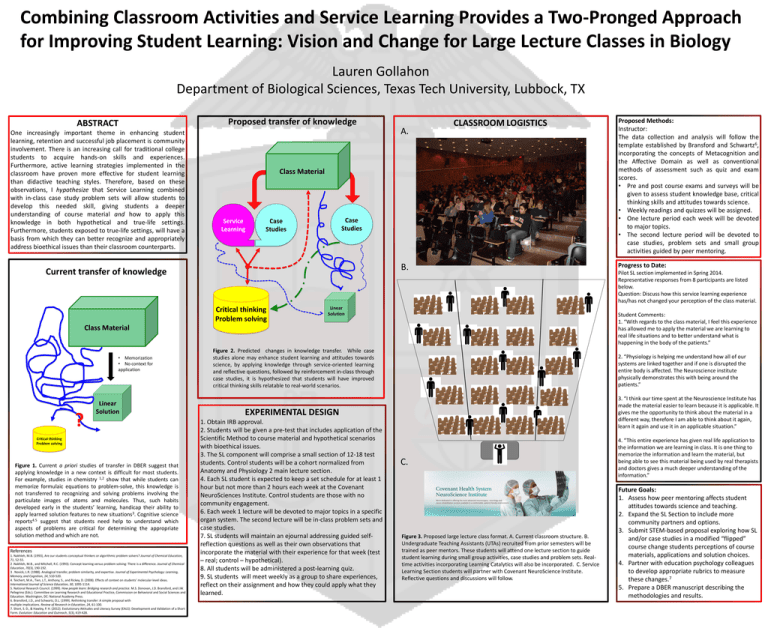
Identify the location of shower caps. (528, 485), (508, 485).